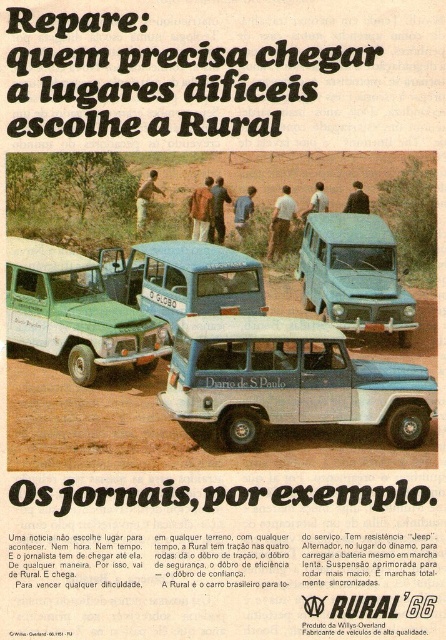
You are a delivery driver who needs to place a package on the blue matte van at center. You are currently standing at the position of the blue fabric shirt at center. The package must be placed within 5 meters to be delivered successfully. Can you deliver the package without moving closer?

The blue matte van at center is 7.42 meters away from the blue fabric shirt at center. Since the required distance for delivery is within 5 meters, you cannot deliver the package without moving closer.

In the ad for the Rural vehicle, there are two people wearing a blue fabric shirt at center and a dark brown leather jacket at center. Which clothing item is smaller in size?

The blue fabric shirt at center is smaller in size compared to the dark brown leather jacket at center.

What is located at point (184,280) in the image?

The point (184,280) indicates a blue matte van at center.